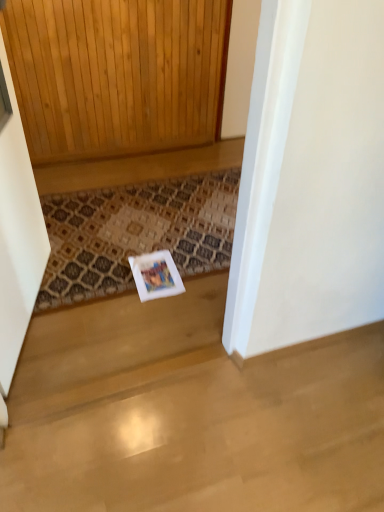
Question: Does white wood screen door at left appear on the left side of patterned carpet at center?

Choices:
 (A) yes
 (B) no

Answer: (A)

Question: Considering the relative sizes of white wood screen door at left and patterned carpet at center in the image provided, is white wood screen door at left wider than patterned carpet at center?

Choices:
 (A) yes
 (B) no

Answer: (B)

Question: Is white wood screen door at left not near patterned carpet at center?

Choices:
 (A) no
 (B) yes

Answer: (A)

Question: From the image's perspective, is white wood screen door at left located beneath patterned carpet at center?

Choices:
 (A) yes
 (B) no

Answer: (B)

Question: From a real-world perspective, is white wood screen door at left positioned under patterned carpet at center based on gravity?

Choices:
 (A) yes
 (B) no

Answer: (B)

Question: From the image's perspective, does white wood screen door at left appear higher than patterned carpet at center?

Choices:
 (A) no
 (B) yes

Answer: (B)

Question: Is patterned carpet at center next to white wood screen door at left?

Choices:
 (A) no
 (B) yes

Answer: (A)

Question: Is patterned carpet at center positioned before white wood screen door at left?

Choices:
 (A) yes
 (B) no

Answer: (B)

Question: Considering the relative sizes of patterned carpet at center and white wood screen door at left in the image provided, is patterned carpet at center bigger than white wood screen door at left?

Choices:
 (A) no
 (B) yes

Answer: (A)

Question: Could white wood screen door at left be considered to be inside patterned carpet at center?

Choices:
 (A) yes
 (B) no

Answer: (B)

Question: Is patterned carpet at center to the right of white wood screen door at left from the viewer's perspective?

Choices:
 (A) no
 (B) yes

Answer: (B)

Question: Is the depth of patterned carpet at center greater than that of white wood screen door at left?

Choices:
 (A) no
 (B) yes

Answer: (B)

Question: From a real-world perspective, relative to white wood screen door at left, is patterned carpet at center vertically above or below?

Choices:
 (A) above
 (B) below

Answer: (B)